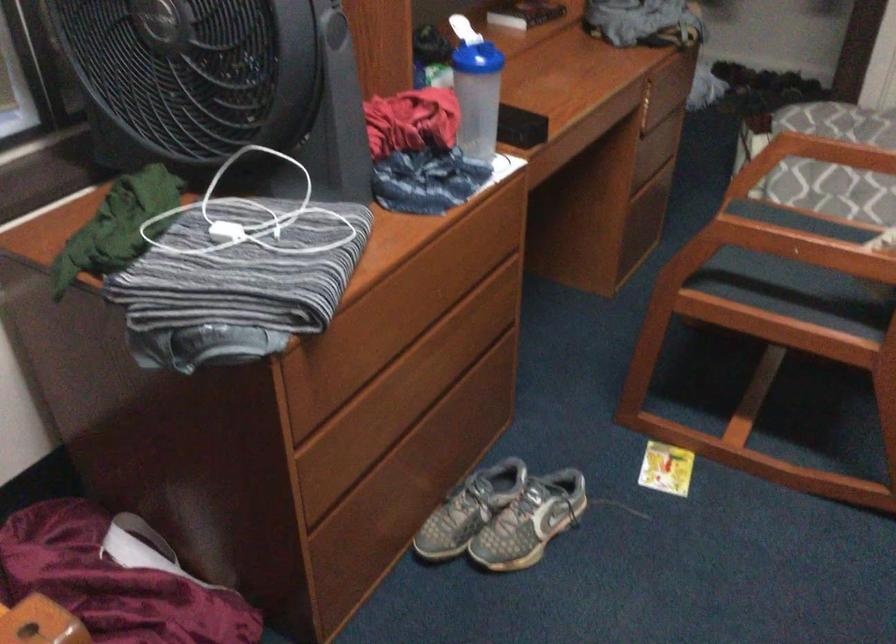
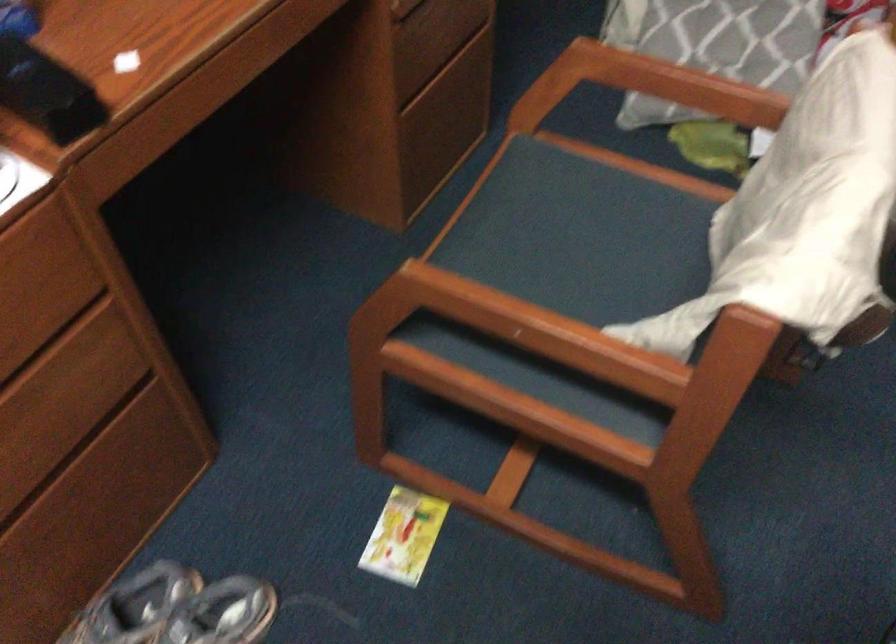
What movement of the cameraman would produce the second image?

The cameraman walked toward right, forward.